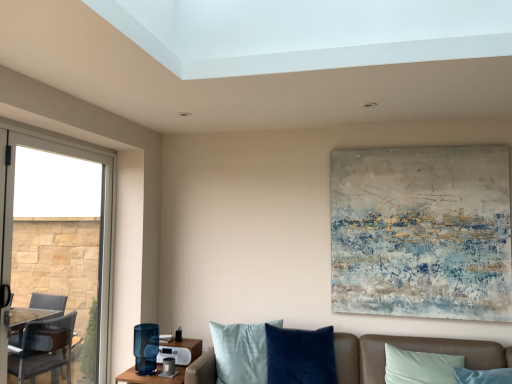
Describe the element at coordinates (422, 232) in the screenshot. The image size is (512, 384). I see `textured canvas painting at upper center` at that location.

You are a GUI agent. You are given a task and a screenshot of the screen. Output one action in this format:
    pyautogui.click(x=<x>, y=<y>)
    Task: Click on the clear glass window at left
    This screenshot has height=384, width=512.
    Given the screenshot: What is the action you would take?
    pyautogui.click(x=56, y=258)

Consider the image. Between clear glass window at left and textured canvas painting at upper center, which one has smaller width?

textured canvas painting at upper center.

Does point (64, 307) come farther from viewer compared to point (341, 207)?

Yes, it is behind point (341, 207).

Is the depth of clear glass window at left greater than that of textured canvas painting at upper center?

That is False.

The width and height of the screenshot is (512, 384). What are the coordinates of `window lying below the textured canvas painting at upper center (from the image's perspective)` in the screenshot? It's located at (56, 258).

Which of these two, leather couch at lower right or textured canvas painting at upper center, stands taller?

textured canvas painting at upper center is taller.

Which is in front, leather couch at lower right or textured canvas painting at upper center?

leather couch at lower right is in front.

Is leather couch at lower right next to textured canvas painting at upper center?

leather couch at lower right and textured canvas painting at upper center are not in contact.

Which is more to the left, leather couch at lower right or textured canvas painting at upper center?

From the viewer's perspective, leather couch at lower right appears more on the left side.

Which object is closer to the camera, velvet brown couch at lower center or clear glass window at left?

velvet brown couch at lower center is in front.

Is velvet brown couch at lower center turned away from clear glass window at left?

velvet brown couch at lower center does not have its back to clear glass window at left.

From the image's perspective, would you say velvet brown couch at lower center is shown under clear glass window at left?

Yes, from the image's perspective, velvet brown couch at lower center is beneath clear glass window at left.

Is velvet brown couch at lower center not inside clear glass window at left?

velvet brown couch at lower center is positioned outside clear glass window at left.

Is leather couch at lower right wider or thinner than clear glass window at left?

leather couch at lower right is wider than clear glass window at left.

Is the surface of leather couch at lower right in direct contact with clear glass window at left?

leather couch at lower right and clear glass window at left are not in contact.

Is leather couch at lower right not inside clear glass window at left?

Yes, leather couch at lower right is outside of clear glass window at left.

Considering the positions of points (376, 379) and (92, 308), is point (376, 379) closer to camera compared to point (92, 308)?

Yes, it is.

From the image's perspective, is leather couch at lower right beneath velvet brown couch at lower center?

Actually, leather couch at lower right appears above velvet brown couch at lower center in the image.

Looking at this image, measure the distance between leather couch at lower right and velvet brown couch at lower center.

0.79 inches.

Which of these two, leather couch at lower right or velvet brown couch at lower center, is smaller?

leather couch at lower right is smaller.

Which object is further away from the camera, leather couch at lower right or velvet brown couch at lower center?

Positioned behind is leather couch at lower right.

Can you confirm if textured canvas painting at upper center is bigger than leather couch at lower right?

Yes.

Is there a large distance between textured canvas painting at upper center and leather couch at lower right?

That's not correct — textured canvas painting at upper center is a little close to leather couch at lower right.

Does textured canvas painting at upper center appear on the right side of leather couch at lower right?

Correct, you'll find textured canvas painting at upper center to the right of leather couch at lower right.

Is textured canvas painting at upper center taller than leather couch at lower right?

Correct, textured canvas painting at upper center is much taller as leather couch at lower right.

Considering their positions, is clear glass window at left located in front of or behind leather couch at lower right?

clear glass window at left is positioned closer to the viewer than leather couch at lower right.

I want to click on couch behind the clear glass window at left, so click(x=426, y=351).

Is point (55, 157) in front of point (483, 352)?

No, (55, 157) is behind (483, 352).

From the image's perspective, which one is positioned higher, clear glass window at left or leather couch at lower right?

clear glass window at left appears higher in the image.

Locate an element on the screen. This screenshot has height=384, width=512. picture frame that appears above the clear glass window at left (from a real-world perspective) is located at coordinates (422, 232).

I want to click on couch directly beneath the textured canvas painting at upper center (from a real-world perspective), so click(x=426, y=351).

When comparing their distances from leather couch at lower right, does matte blue glass at lower center or clear glass window at left seem closer?

Among the two, matte blue glass at lower center is located nearer to leather couch at lower right.

Looking at the image, which one is located further to textured canvas painting at upper center, leather couch at lower right or matte blue glass at lower center?

matte blue glass at lower center lies further to textured canvas painting at upper center than the other object.

Which object lies nearer to the anchor point leather couch at lower right, clear glass window at left or matte blue glass at lower center?

matte blue glass at lower center is closer to leather couch at lower right.

When comparing their distances from leather couch at lower right, does clear glass window at left or velvet brown couch at lower center seem closer?

The object closer to leather couch at lower right is velvet brown couch at lower center.

Which object lies further to the anchor point velvet brown couch at lower center, leather couch at lower right or textured canvas painting at upper center?

textured canvas painting at upper center.

Based on their spatial positions, is leather couch at lower right or clear glass window at left further from textured canvas painting at upper center?

clear glass window at left is further to textured canvas painting at upper center.

Looking at the image, which one is located closer to textured canvas painting at upper center, velvet brown couch at lower center or leather couch at lower right?

Among the two, leather couch at lower right is located nearer to textured canvas painting at upper center.

Based on their spatial positions, is velvet brown couch at lower center or leather couch at lower right further from matte blue glass at lower center?

leather couch at lower right.

The image size is (512, 384). In order to click on table located between clear glass window at left and velvet brown couch at lower center in the left-right direction in this screenshot , I will do `click(161, 363)`.

This screenshot has height=384, width=512. Identify the location of couch between matte blue glass at lower center and textured canvas painting at upper center. (426, 351).

The width and height of the screenshot is (512, 384). Find the location of `studio couch between matte blue glass at lower center and leather couch at lower right`. studio couch between matte blue glass at lower center and leather couch at lower right is located at coordinates (406, 349).

Where is `studio couch between clear glass window at left and leather couch at lower right`? The image size is (512, 384). studio couch between clear glass window at left and leather couch at lower right is located at coordinates (406, 349).